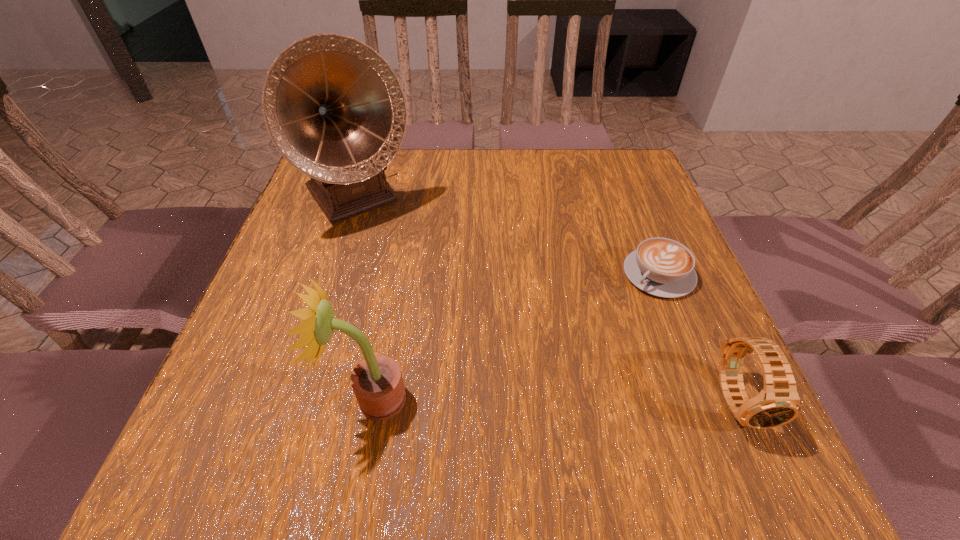
In order to click on vacant area that satisfies the following two spatial constraints: 1. on the front side of the phonograph record; 2. on the face of the second tallest object in this screenshot , I will do `click(295, 399)`.